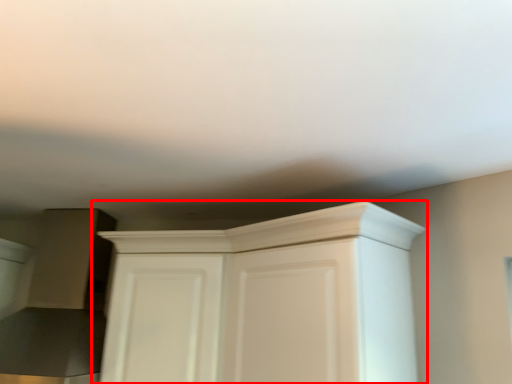
Question: From the image's perspective, where is cupboard (annotated by the red box) located in relation to door in the image?

Choices:
 (A) above
 (B) below

Answer: (A)